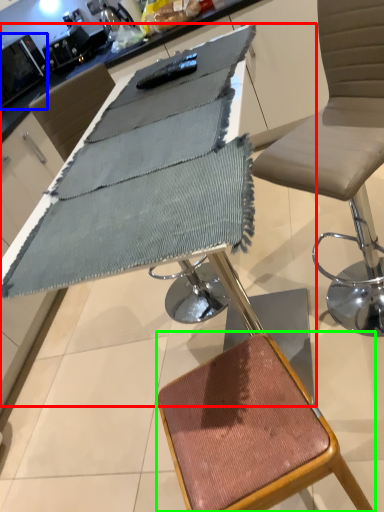
Question: Which object is positioned farthest from table (highlighted by a red box)? Select from appliance (highlighted by a blue box) and stool (highlighted by a green box).

Choices:
 (A) appliance
 (B) stool

Answer: (A)